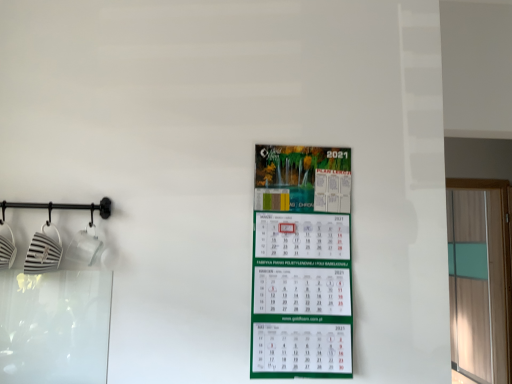
Describe the element at coordinates (302, 263) in the screenshot. I see `green matte calendar at center` at that location.

Locate an element on the screen. The image size is (512, 384). green matte calendar at center is located at coordinates (302, 263).

Identify the location of transparent glass door at right. Image resolution: width=512 pixels, height=384 pixels. (480, 278).

Measure the distance between transparent glass door at right and camera.

transparent glass door at right and camera are 3.36 meters apart.

This screenshot has height=384, width=512. What do you see at coordinates (480, 278) in the screenshot? I see `transparent glass door at right` at bounding box center [480, 278].

The width and height of the screenshot is (512, 384). In order to click on green matte calendar at center in this screenshot , I will do `click(302, 263)`.

Is transparent glass door at right at the right side of green matte calendar at center?

Correct, you'll find transparent glass door at right to the right of green matte calendar at center.

Is transparent glass door at right in front of green matte calendar at center?

No, it is not.

Between point (499, 383) and point (290, 358), which one is positioned in front?

Positioned in front is point (290, 358).

From the image's perspective, who appears lower, transparent glass door at right or green matte calendar at center?

transparent glass door at right.

From the picture: From a real-world perspective, is transparent glass door at right above or below green matte calendar at center?

transparent glass door at right is below green matte calendar at center.

Is transparent glass door at right wider or thinner than green matte calendar at center?

Considering their sizes, transparent glass door at right looks broader than green matte calendar at center.

Based on the photo, considering the relative sizes of transparent glass door at right and green matte calendar at center in the image provided, is transparent glass door at right shorter than green matte calendar at center?

Incorrect, the height of transparent glass door at right does not fall short of that of green matte calendar at center.

Is transparent glass door at right bigger than green matte calendar at center?

Correct, transparent glass door at right is larger in size than green matte calendar at center.

Choose the correct answer: Is transparent glass door at right inside green matte calendar at center or outside it?

transparent glass door at right is spatially situated outside green matte calendar at center.

In the scene shown: Are transparent glass door at right and green matte calendar at center beside each other?

They are not placed beside each other.

Could you tell me if transparent glass door at right is facing green matte calendar at center?

No, transparent glass door at right is not facing towards green matte calendar at center.

The height and width of the screenshot is (384, 512). I want to click on window that appears below the green matte calendar at center (from a real-world perspective), so click(480, 278).

Considering the relative positions of green matte calendar at center and transparent glass door at right in the image provided, is green matte calendar at center to the left of transparent glass door at right from the viewer's perspective?

Yes, green matte calendar at center is to the left of transparent glass door at right.

From the picture: Relative to transparent glass door at right, is green matte calendar at center in front or behind?

green matte calendar at center is positioned closer to the viewer than transparent glass door at right.

Is point (342, 370) positioned after point (453, 252)?

That is False.

From the image's perspective, is green matte calendar at center over transparent glass door at right?

Yes, from the image's perspective, green matte calendar at center is over transparent glass door at right.

From a real-world perspective, which object rests below the other?

From a 3D spatial view, transparent glass door at right is below.

Can you confirm if green matte calendar at center is wider than transparent glass door at right?

Incorrect, the width of green matte calendar at center does not surpass that of transparent glass door at right.

From their relative heights in the image, would you say green matte calendar at center is taller or shorter than transparent glass door at right?

Considering their sizes, green matte calendar at center has less height than transparent glass door at right.

Which of these two, green matte calendar at center or transparent glass door at right, is bigger?

transparent glass door at right.

Can we say green matte calendar at center lies outside transparent glass door at right?

green matte calendar at center lies outside transparent glass door at right's area.

Is green matte calendar at center next to transparent glass door at right and touching it?

No, green matte calendar at center is not next to transparent glass door at right.

Looking at this image, could you tell me if green matte calendar at center is turned towards transparent glass door at right?

No, green matte calendar at center is not facing towards transparent glass door at right.

Measure the distance between green matte calendar at center and transparent glass door at right.

green matte calendar at center is 3.26 meters away from transparent glass door at right.

Locate an element on the screen. Image resolution: width=512 pixels, height=384 pixels. poster on the left of transparent glass door at right is located at coordinates (302, 263).

What are the coordinates of `window located behind the green matte calendar at center` in the screenshot? It's located at (480, 278).

Identify the location of window that appears below the green matte calendar at center (from the image's perspective). The height and width of the screenshot is (384, 512). (480, 278).